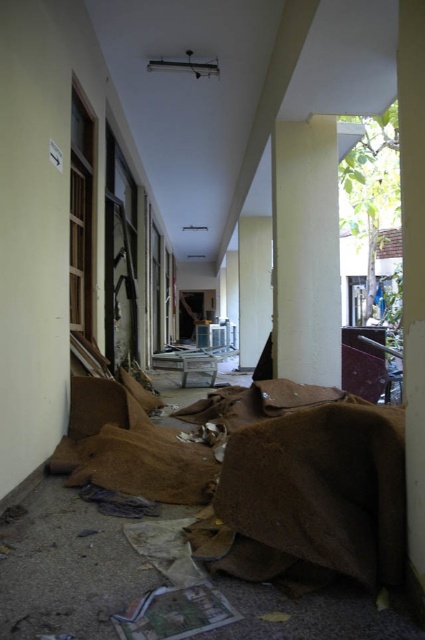
You are a delivery person carrying a box that is 2 meters long. You need to move it through the corridor between the smooth concrete pillar at center and the smooth concrete pillar at right. Can you fit the box through the space between them?

The distance between the smooth concrete pillar at center and the smooth concrete pillar at right is 2.53 meters. Since the box is 2 meters long, it can fit through the space between them as the distance is greater than the box length.

You are a painter who needs to reach a high spot on the wall. You have two options for standing on pillars in the corridor. Which pillar, the smooth concrete pillar at center or the smooth concrete pillar at right, would allow you to reach higher?

The smooth concrete pillar at center has a greater height compared to the smooth concrete pillar at right, so standing on it would allow you to reach higher.

You are a delivery person carrying a 1.5 meter wide box and need to navigate through the corridor. There are two smooth concrete pillars in your path. The first is the smooth concrete pillar at center, and the second is the smooth concrete pillar at right. Which pillar do you think you can pass through more easily with your box?

The smooth concrete pillar at right has a smaller width compared to the smooth concrete pillar at center. Since your box is 1.5 meters wide, you can pass through the space around the smooth concrete pillar at right more easily than the wider smooth concrete pillar at center.